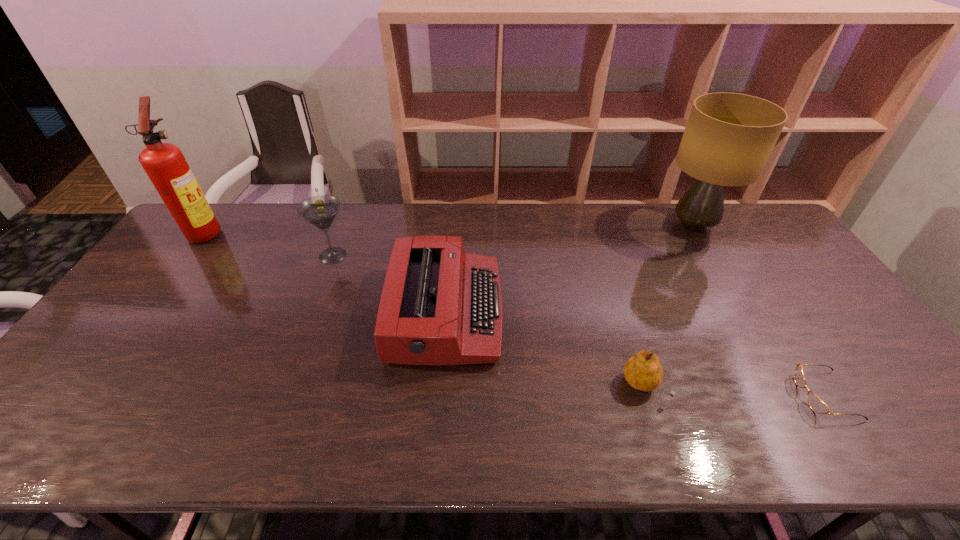
The image size is (960, 540). Find the location of `lampshade at the right edge`. lampshade at the right edge is located at coordinates pyautogui.click(x=729, y=137).

Find the location of a particular element. This screenshot has height=540, width=960. spectacles located at the right edge is located at coordinates (816, 404).

Locate an element on the screen. object that is at the far left corner is located at coordinates (164, 163).

Identify the location of object at the far right corner. (729, 137).

Where is `object present at the near right corner`? object present at the near right corner is located at coordinates (816, 404).

This screenshot has height=540, width=960. What are the coordinates of `vacant area at the far edge of the desktop` in the screenshot? It's located at (636, 239).

At what (x,y) coordinates should I click in order to perform the action: click on vacant space at the near edge. Please return your answer as a coordinate pair (x, y). Looking at the image, I should click on (645, 451).

At what (x,y) coordinates should I click in order to perform the action: click on vacant region at the left edge of the desktop. Please return your answer as a coordinate pair (x, y). Looking at the image, I should click on (173, 275).

Identify the location of free region at the right edge of the desktop. This screenshot has height=540, width=960. (875, 401).

Image resolution: width=960 pixels, height=540 pixels. Identify the location of vacant space at the near left corner of the desktop. (14, 454).